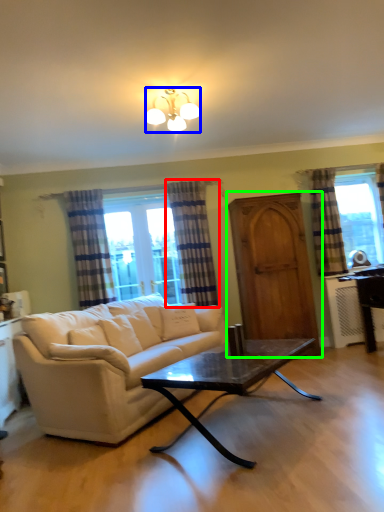
Question: Based on their relative distances, which object is nearer to curtain (highlighted by a red box)? Choose from lamp (highlighted by a blue box) and screen door (highlighted by a green box).

Choices:
 (A) lamp
 (B) screen door

Answer: (B)